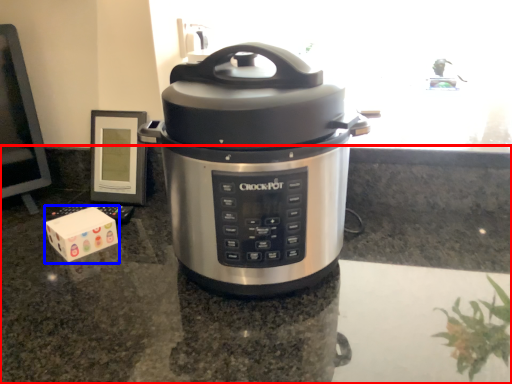
Question: Which of the following is the farthest to the observer, counter top (highlighted by a red box) or block (highlighted by a blue box)?

Choices:
 (A) counter top
 (B) block

Answer: (B)